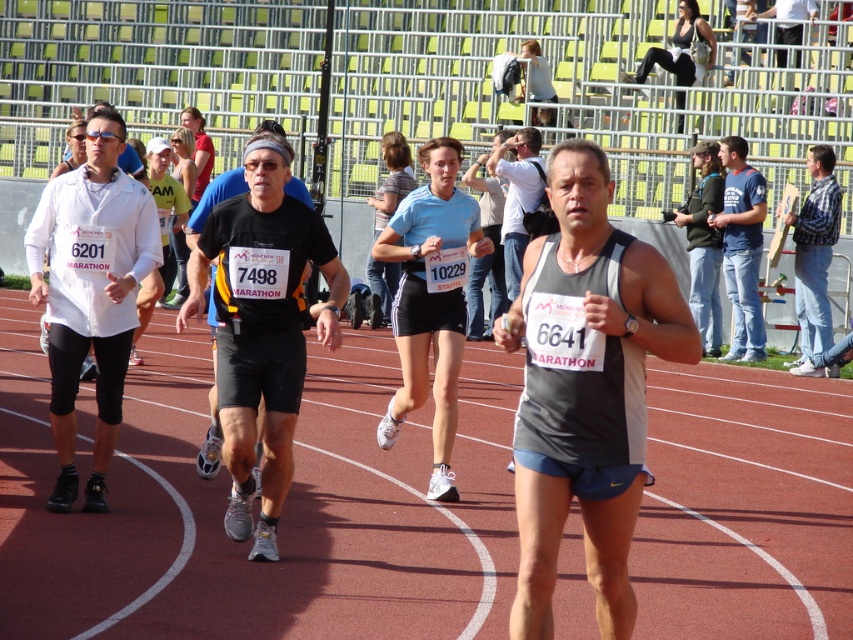
Does gray fabric shirt at center have a lesser height compared to black matte running shorts at center?

In fact, gray fabric shirt at center may be taller than black matte running shorts at center.

Is point (515, 234) positioned in front of point (213, 394)?

No, it is not.

Where is `gray fabric shirt at center`? The height and width of the screenshot is (640, 853). gray fabric shirt at center is located at coordinates (517, 196).

Does point (618, 632) come in front of point (409, 275)?

Yes.

The height and width of the screenshot is (640, 853). Describe the element at coordinates (585, 387) in the screenshot. I see `gray fabric tank top at center` at that location.

The image size is (853, 640). Identify the location of gray fabric tank top at center. (585, 387).

Can you confirm if red rubber track at center is positioned to the right of plaid shirt at center?

Incorrect, red rubber track at center is not on the right side of plaid shirt at center.

Is red rubber track at center to the left of plaid shirt at center from the viewer's perspective?

Yes, red rubber track at center is to the left of plaid shirt at center.

The height and width of the screenshot is (640, 853). In order to click on red rubber track at center in this screenshot , I will do `click(282, 515)`.